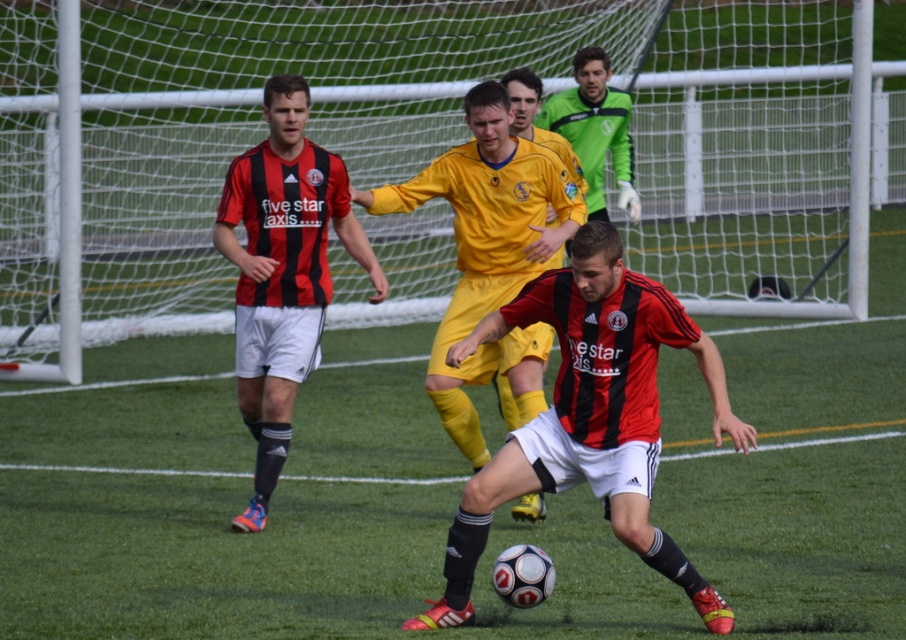
Question: Which point is farther from the camera taking this photo?

Choices:
 (A) (488, 147)
 (B) (605, 99)
 (C) (453, 348)

Answer: (B)

Question: Which object appears closest to the camera in this image?

Choices:
 (A) yellow matte jersey at center
 (B) matte black jersey at center

Answer: (A)

Question: Which point is closer to the camera?

Choices:
 (A) green matte jersey at upper center
 (B) white mesh net at center
 (C) matte black soccer player at center
 (D) matte black jersey at center

Answer: (C)

Question: Where is matte black soccer player at center located in relation to yellow matte jersey at center in the image?

Choices:
 (A) above
 (B) below

Answer: (B)

Question: Is matte black jersey at center smaller than yellow matte jersey at center?

Choices:
 (A) no
 (B) yes

Answer: (B)

Question: Considering the relative positions of white mesh net at center and matte black jersey at center in the image provided, where is white mesh net at center located with respect to matte black jersey at center?

Choices:
 (A) above
 (B) below

Answer: (A)